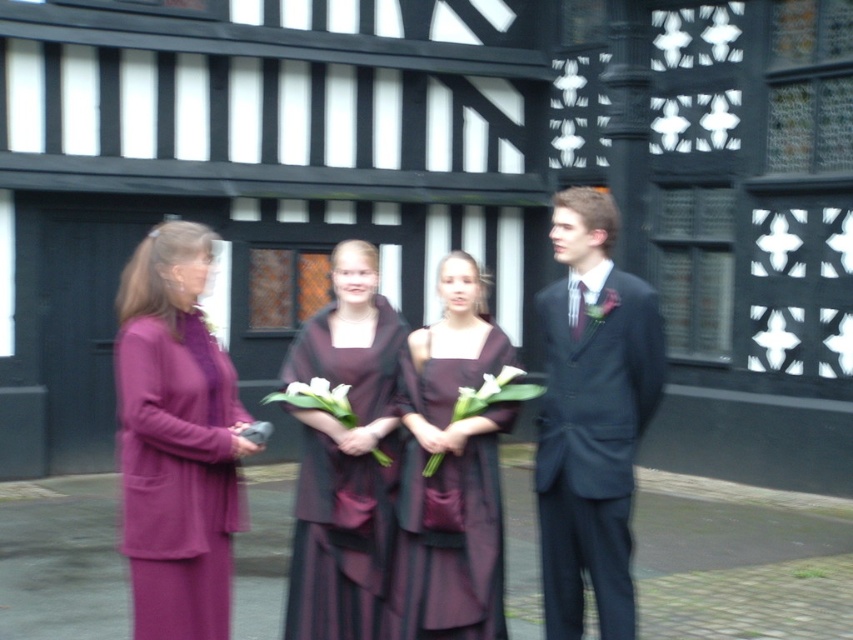
Between point (605, 403) and point (454, 321), which one is positioned behind?

Positioned behind is point (454, 321).

In the scene shown: Is matte black suit at center smaller than matte burgundy dress at center?

Actually, matte black suit at center might be larger than matte burgundy dress at center.

Identify the location of matte black suit at center. The width and height of the screenshot is (853, 640). (590, 417).

Can you confirm if matte burgundy dress at center is thinner than white matte flowers at center?

In fact, matte burgundy dress at center might be wider than white matte flowers at center.

Which is more to the right, matte burgundy dress at center or white matte flowers at center?

Positioned to the right is white matte flowers at center.

This screenshot has height=640, width=853. I want to click on matte burgundy dress at center, so click(x=451, y=468).

Can you confirm if purple matte dress at left is smaller than matte black suit at center?

Yes.

In the scene shown: Is purple matte dress at left positioned behind matte black suit at center?

No, purple matte dress at left is in front of matte black suit at center.

Measure the distance between point (195, 257) and camera.

Point (195, 257) is 4.39 meters from camera.

At what (x,y) coordinates should I click in order to perform the action: click on purple matte dress at left. Please return your answer as a coordinate pair (x, y). Looking at the image, I should click on (177, 440).